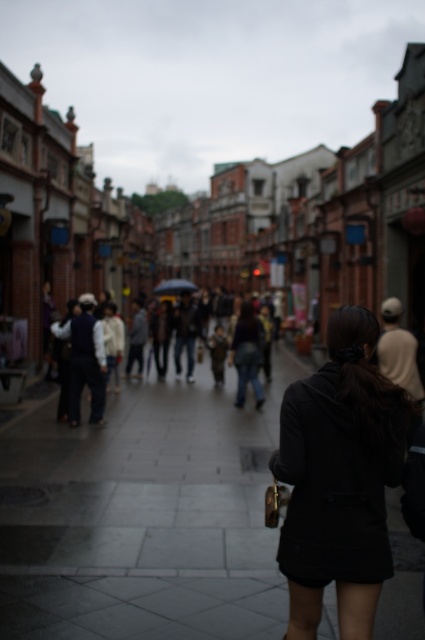
You are a pedestrian trying to cross the street. You see the smooth concrete pavement at center and the transparent plastic umbrella at center. Which object is closer to you?

The smooth concrete pavement at center is closer to you because it is in front of the transparent plastic umbrella at center.

In the scene described, there is a woman wearing a black matte coat at center. If you were standing at the point marked by coordinates point (340,477), would you be positioned directly behind her?

The point (340,477) marks the black matte coat at center, so standing at that point would place you directly at the location of the coat, not behind her.

In the scene shown: You are a delivery person trying to navigate through the street. You see the smooth concrete pavement at center and the black matte coat at center. Which one is wider?

The smooth concrete pavement at center is wider than the black matte coat at center.